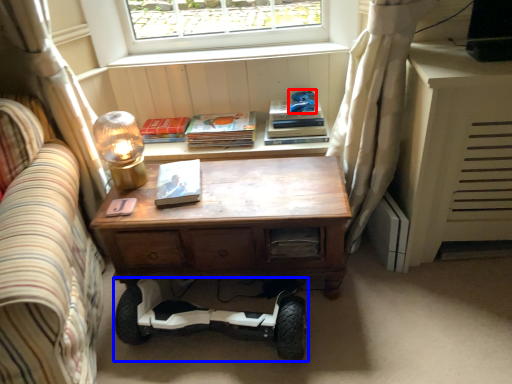
Question: Which of the following is the closest to the observer, toy (highlighted by a red box) or segway (highlighted by a blue box)?

Choices:
 (A) toy
 (B) segway

Answer: (B)